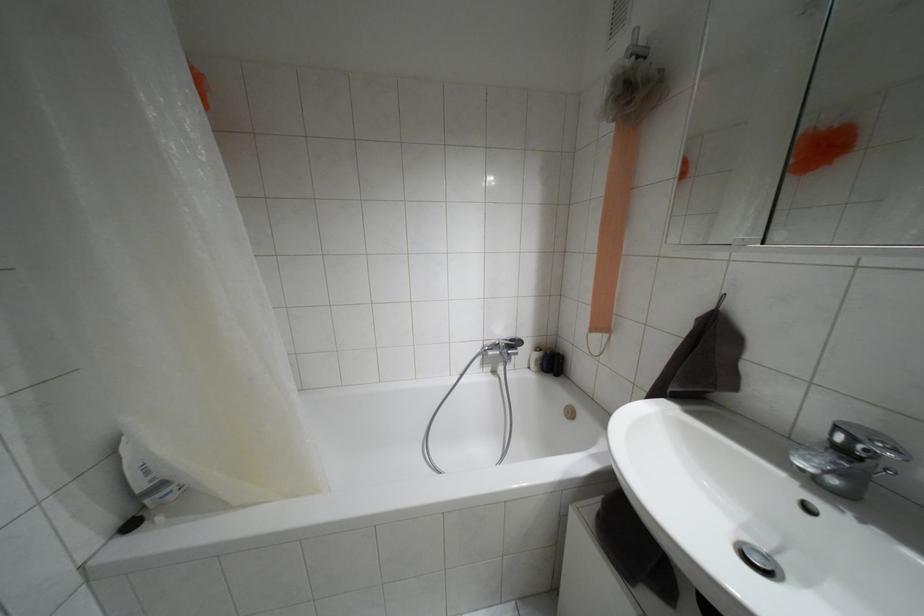
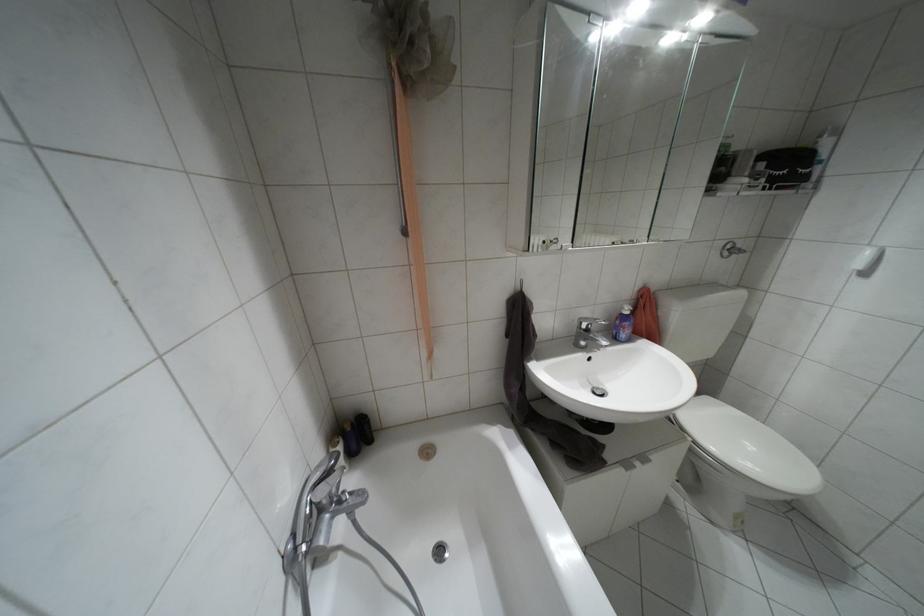
How did the camera likely rotate?

The camera's rotation is toward right-down.